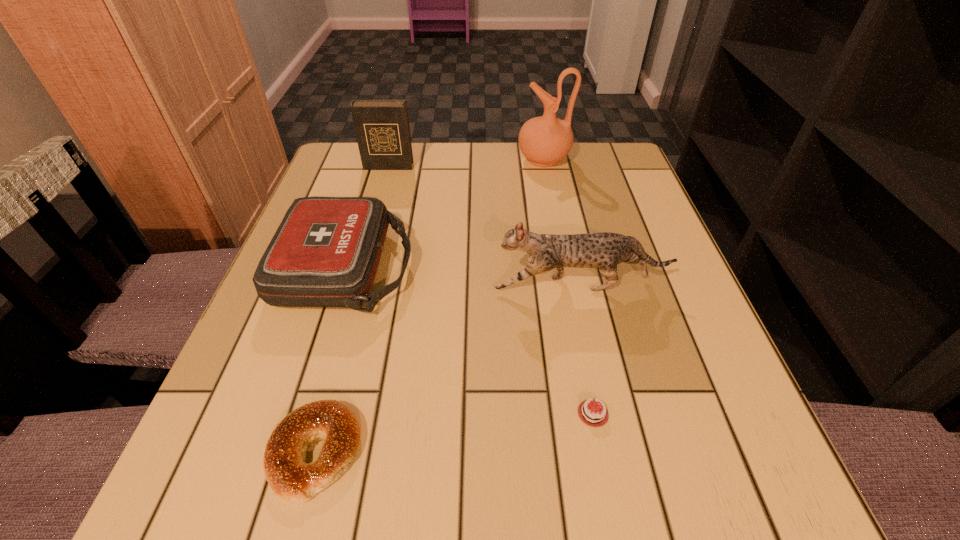
What are the coordinates of `the first-aid kit that is positioned at the left edge` in the screenshot? It's located at (326, 251).

Locate an element on the screen. Image resolution: width=960 pixels, height=540 pixels. bagel that is positioned at the left edge is located at coordinates (289, 476).

I want to click on pottery that is at the right edge, so click(x=544, y=140).

Find the location of a particular element. This screenshot has width=960, height=540. cat that is positioned at the right edge is located at coordinates (604, 250).

This screenshot has width=960, height=540. I want to click on object present at the far left corner, so click(x=382, y=129).

Locate an element on the screen. Image resolution: width=960 pixels, height=540 pixels. object located in the near left corner section of the desktop is located at coordinates (289, 476).

You are a GUI agent. You are given a task and a screenshot of the screen. Output one action in this format:
    pyautogui.click(x=<x>, y=<y>)
    Task: Click on the object positioned at the far right corner
    The width and height of the screenshot is (960, 540).
    Given the screenshot: What is the action you would take?
    pyautogui.click(x=544, y=140)

Where is `blank space at the far edge of the desktop`? The width and height of the screenshot is (960, 540). blank space at the far edge of the desktop is located at coordinates (467, 152).

Where is `vacant space at the near edge of the desktop`? The width and height of the screenshot is (960, 540). vacant space at the near edge of the desktop is located at coordinates (580, 476).

Identify the location of free space at the left edge of the desktop. The height and width of the screenshot is (540, 960). (309, 384).